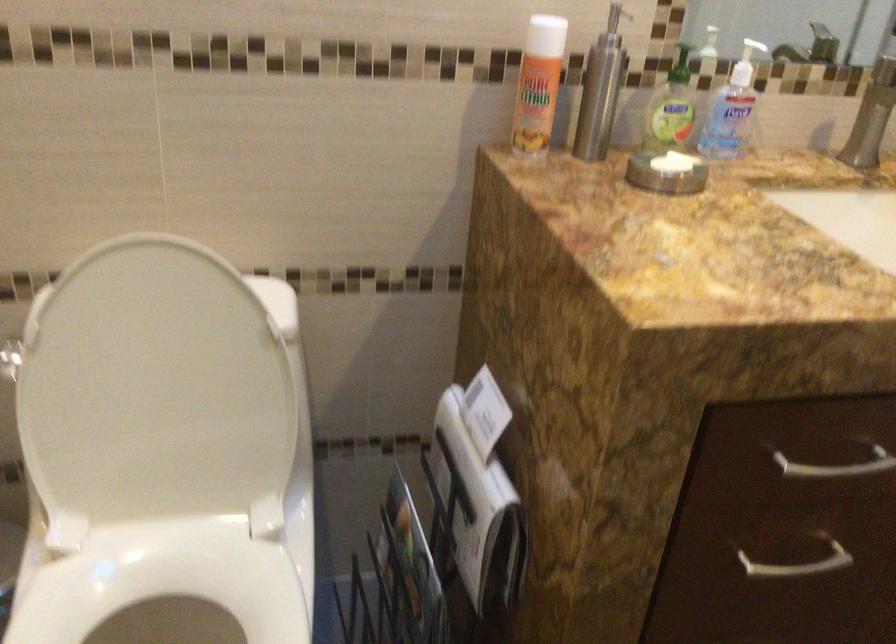
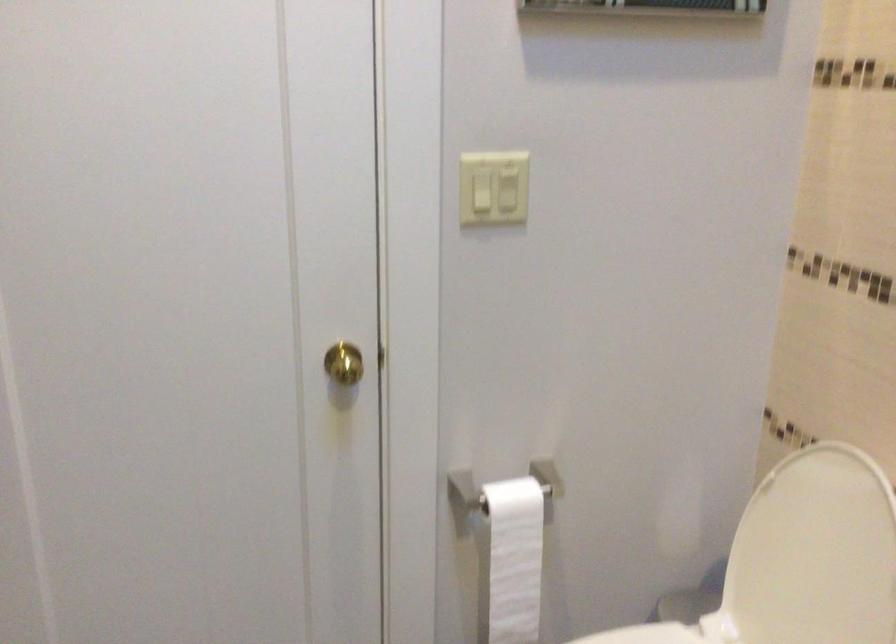
Question: The images are taken continuously from a first-person perspective. In which direction is your viewpoint rotating?

Choices:
 (A) Left
 (B) Right
 (C) Up
 (D) Down

Answer: (A)